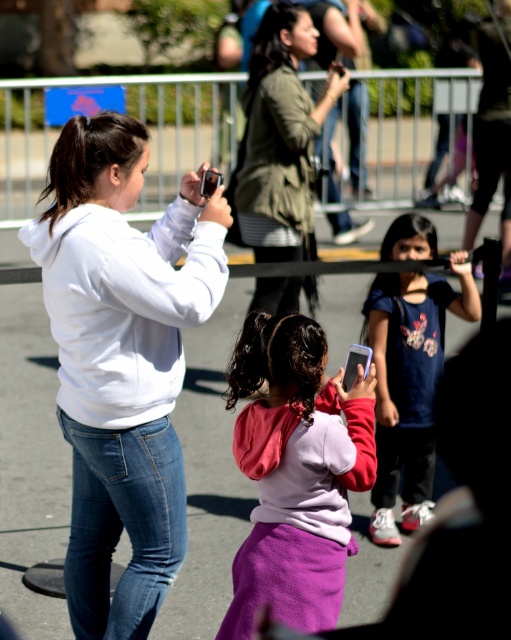
You are a photographer trying to capture a group photo of the scene. You notice the white matte hoodie at upper left and the blue denim jeans at center. Which object should you adjust your focus on if you want to ensure both are in frame without moving the camera?

The white matte hoodie at upper left might be wider than blue denim jeans at center, so you should focus on the white matte hoodie at upper left to ensure both are in frame.

You are a fashion designer observing the crowd at the event. You notice the blue denim jeans at center and the green matte jacket at center. Which clothing item is shorter in height?

The blue denim jeans at center is shorter than the green matte jacket at center.